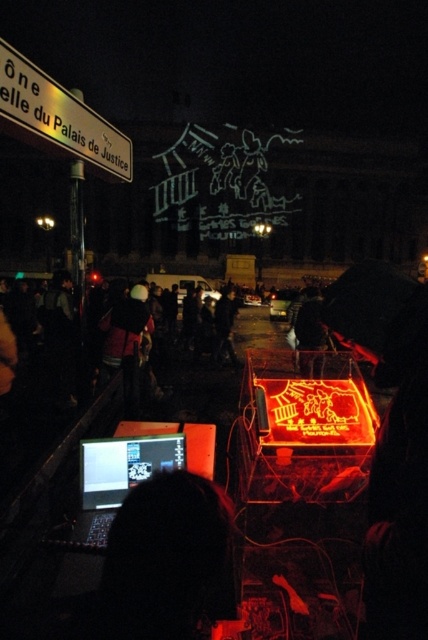
You are standing at the center of the nighttime gathering in front of the classical building. You notice two points marked in the scene. The first point is at coordinate location (95, 630) and the second is at (68, 106). If you were to walk towards the first point, would you be moving towards the stage or away from it?

Based on the coordinates provided, point (95, 630) is in front of point (68, 106). Since the stage is in the foreground of the nighttime scene, moving towards the first point would mean moving towards the stage.

You are standing at the event and want to check the laptop screen to see the displayed text. Given that the black matte laptop at lower left is 6.96 feet away from you, can you comfortably read the text on its screen without moving closer?

The black matte laptop at lower left is 6.96 feet away from the viewer. At this distance, it may be difficult to comfortably read the text on its screen without moving closer, as typical laptop screens are not easily legible from such a distance.

You are a photographer positioned at the center of the scene. You need to capture a photo that includes both the metallic silver sign at upper left and the matte black laptop at lower left. Which object should you adjust your camera angle to focus on first to ensure both are in frame?

The metallic silver sign at upper left is located above the matte black laptop at lower left. To include both in the frame, you should first focus on the metallic silver sign at upper left to ensure the camera angle captures its higher position, then adjust downward to include the matte black laptop at lower left.